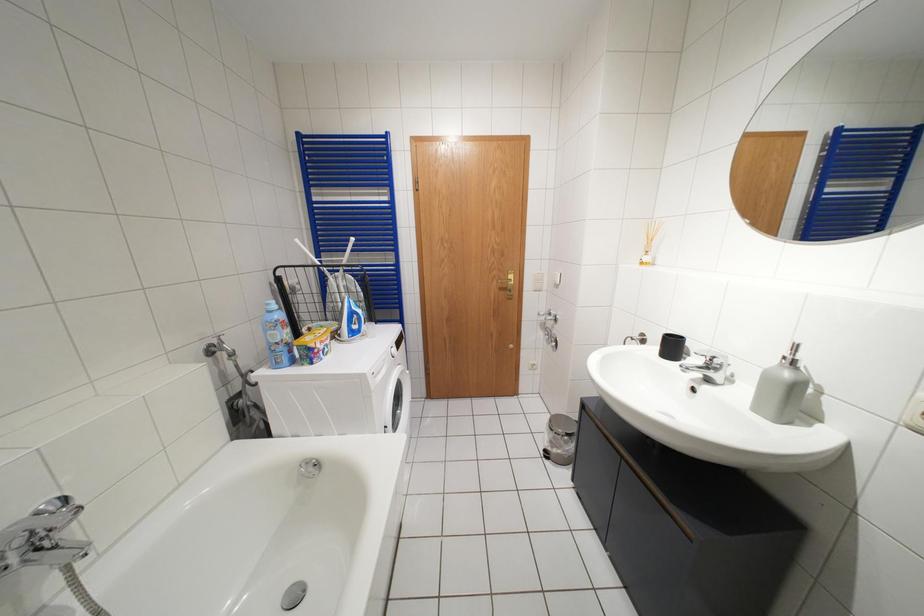
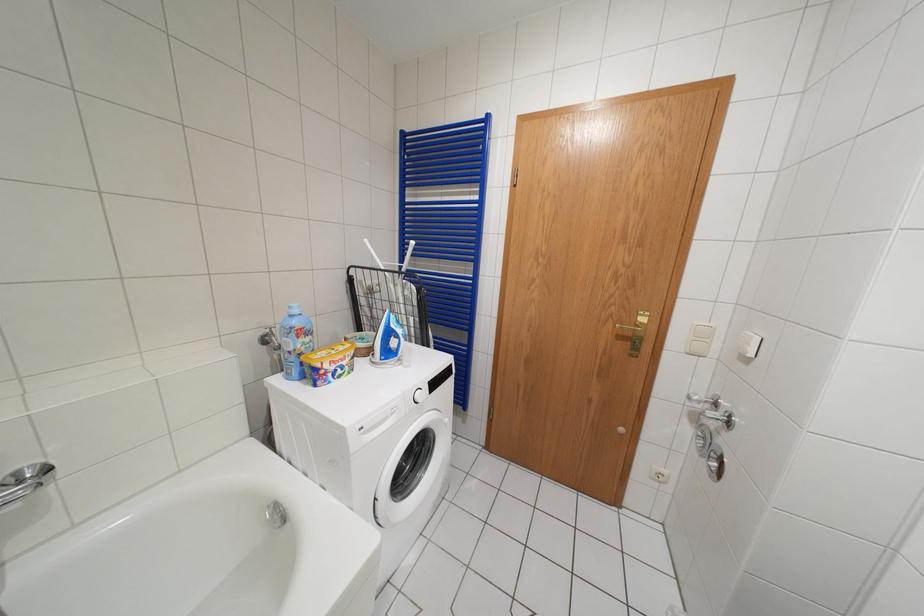
Question: In a continuous first-person perspective shot, in which direction is the camera moving?

Choices:
 (A) Left
 (B) Right
 (C) Forward
 (D) Backward

Answer: (C)